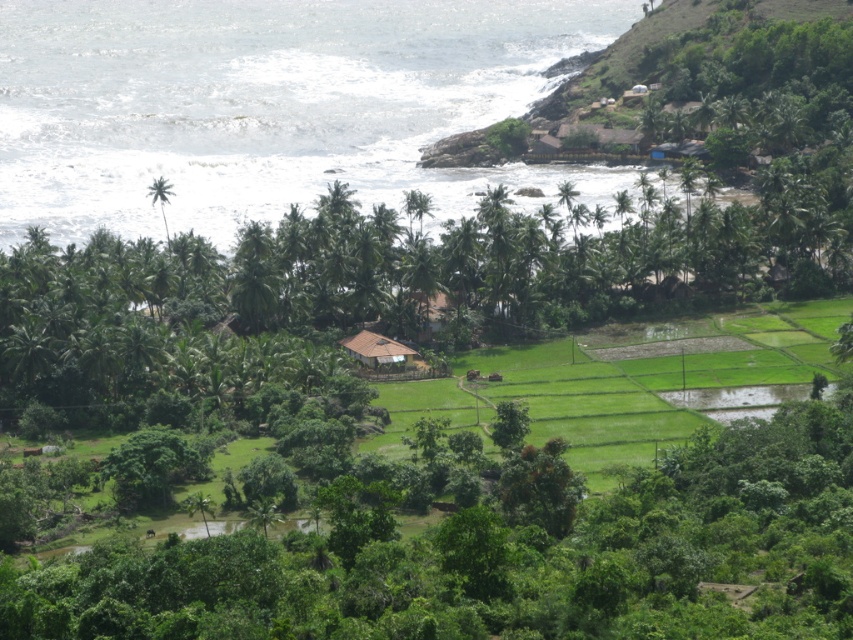
Who is positioned more to the left, brown thatched hut at center or brown wooden hut at center?

From the viewer's perspective, brown thatched hut at center appears more on the left side.

Is brown thatched hut at center thinner than brown wooden hut at center?

Incorrect, brown thatched hut at center's width is not less than brown wooden hut at center's.

Which is in front, point (369, 333) or point (409, 298)?

Point (369, 333) is more forward.

Locate an element on the screen. brown thatched hut at center is located at coordinates (381, 353).

From the picture: Does green leafy hillside at upper right appear on the left side of brown wooden hut at center?

Incorrect, green leafy hillside at upper right is not on the left side of brown wooden hut at center.

The image size is (853, 640). What do you see at coordinates (723, 74) in the screenshot?
I see `green leafy hillside at upper right` at bounding box center [723, 74].

The width and height of the screenshot is (853, 640). Find the location of `green leafy hillside at upper right`. green leafy hillside at upper right is located at coordinates (723, 74).

Who is lower down, brown wooden hut at center or green leafy palm tree at left?

brown wooden hut at center

Consider the image. Who is shorter, brown wooden hut at center or green leafy palm tree at left?

brown wooden hut at center

Describe the element at coordinates (428, 308) in the screenshot. The image size is (853, 640). I see `brown wooden hut at center` at that location.

Where is `brown wooden hut at center`? The image size is (853, 640). brown wooden hut at center is located at coordinates (428, 308).